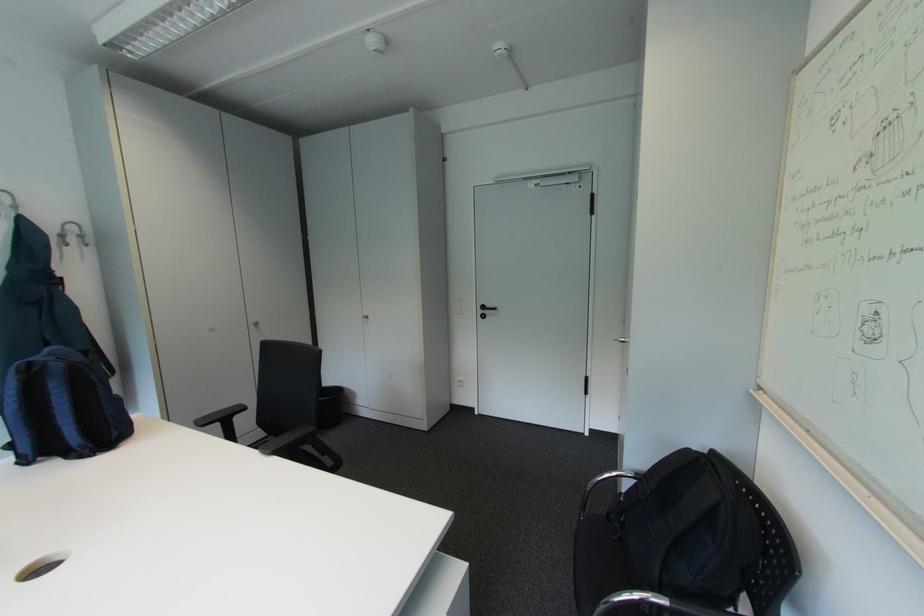
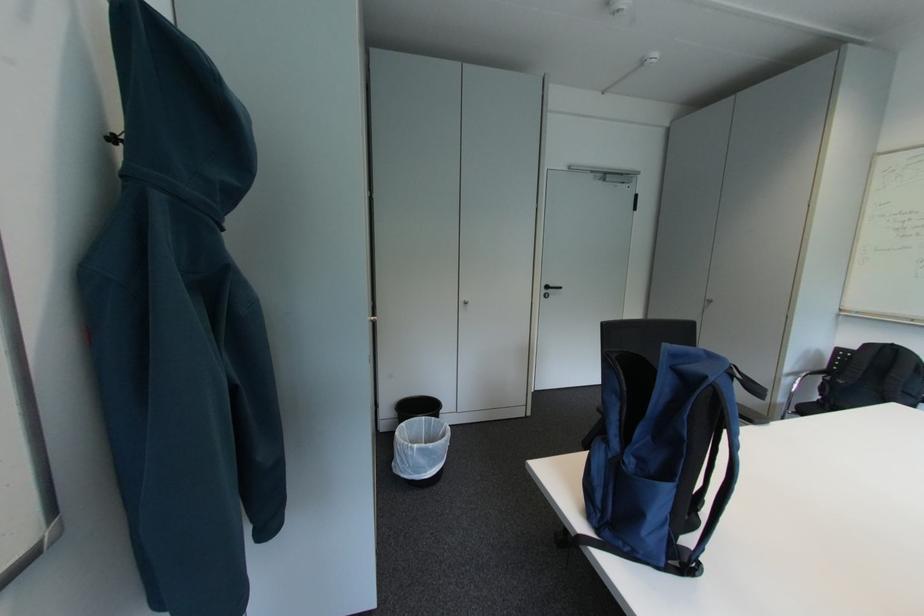
Find the pixel in the second image that matches [492,310] in the first image.

(556, 289)